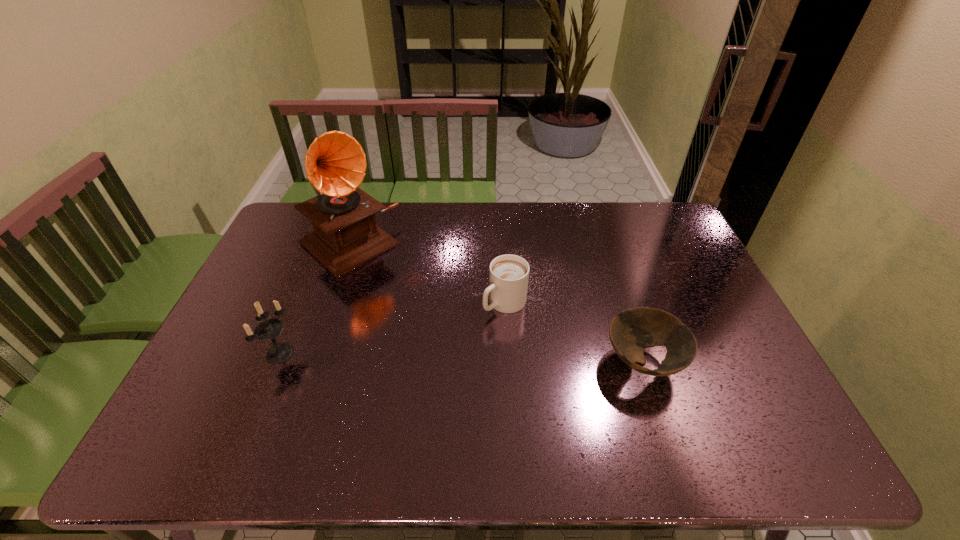
You are a GUI agent. You are given a task and a screenshot of the screen. Output one action in this format:
    pyautogui.click(x=<x>, y=<y>)
    Task: Click on the candle holder
    The width and height of the screenshot is (960, 540).
    Given the screenshot: What is the action you would take?
    pyautogui.click(x=268, y=329)

Image resolution: width=960 pixels, height=540 pixels. I want to click on the rightmost object, so click(x=631, y=331).

The image size is (960, 540). Find the location of `bowl`. bowl is located at coordinates (631, 331).

This screenshot has height=540, width=960. In order to click on the third nearest object in this screenshot , I will do `click(508, 276)`.

I want to click on the third object from left to right, so click(508, 276).

Image resolution: width=960 pixels, height=540 pixels. Identify the location of phonograph record. (346, 236).

This screenshot has width=960, height=540. I want to click on the farthest object, so click(346, 236).

The width and height of the screenshot is (960, 540). Identify the location of vacant area situated 0.130m on the left of the second tallest object. (218, 353).

I want to click on vacant region located 0.400m on the left of the rightmost object, so click(x=450, y=362).

Where is `vacant area situated 0.220m on the side with the handle of the cappuccino`? Image resolution: width=960 pixels, height=540 pixels. vacant area situated 0.220m on the side with the handle of the cappuccino is located at coordinates (435, 363).